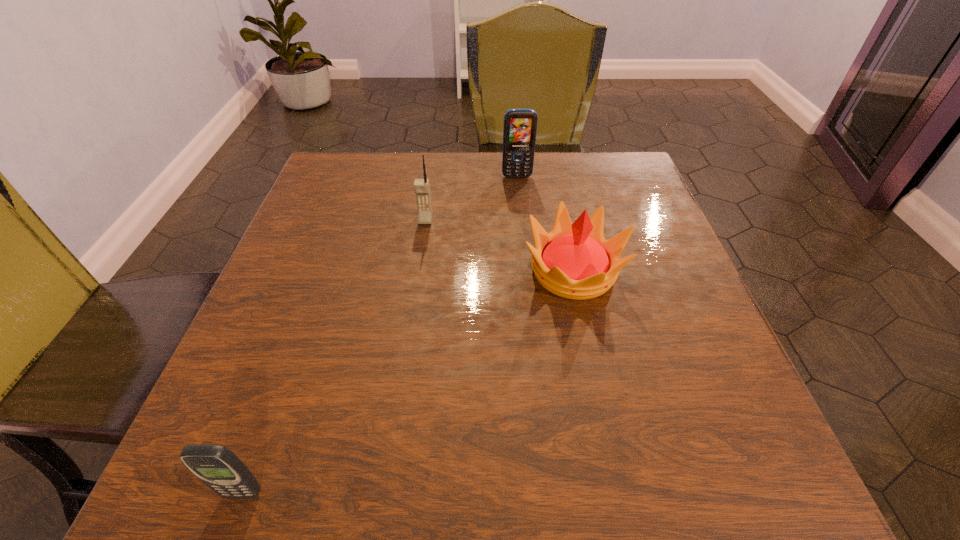
The height and width of the screenshot is (540, 960). I want to click on vacant area that lies between the second nearest object and the rightmost cellular telephone, so click(545, 224).

Where is `empty location between the rightmost cellular telephone and the leftmost object`? The height and width of the screenshot is (540, 960). empty location between the rightmost cellular telephone and the leftmost object is located at coordinates (380, 335).

Where is `free spot between the leftmost object and the second nearest cellular telephone`? The image size is (960, 540). free spot between the leftmost object and the second nearest cellular telephone is located at coordinates (x=334, y=357).

This screenshot has height=540, width=960. What are the coordinates of `object that ranks as the third closest to the farthest cellular telephone` in the screenshot? It's located at (220, 469).

Select which object is the second closest to the farthest cellular telephone. Please provide its 2D coordinates. Your answer should be formatted as a tuple, i.e. [(x, y)], where the tuple contains the x and y coordinates of a point satisfying the conditions above.

[(574, 261)]

Identify which cellular telephone is located as the third nearest to the crown. Please provide its 2D coordinates. Your answer should be formatted as a tuple, i.e. [(x, y)], where the tuple contains the x and y coordinates of a point satisfying the conditions above.

[(220, 469)]

Where is `cellular telephone that is the second closest one to the farthest object`? cellular telephone that is the second closest one to the farthest object is located at coordinates (220, 469).

Identify the location of free spot that satisfies the following two spatial constraints: 1. on the front of the second nearest cellular telephone, where the keypad is located; 2. on the right side of the crown. (419, 271).